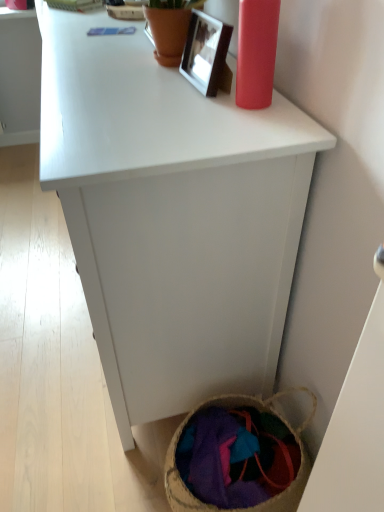
Question: Considering the relative sizes of metallic silver picture frame at upper center and textured woven basket at lower right in the image provided, is metallic silver picture frame at upper center smaller than textured woven basket at lower right?

Choices:
 (A) no
 (B) yes

Answer: (B)

Question: From the image's perspective, is metallic silver picture frame at upper center located beneath textured woven basket at lower right?

Choices:
 (A) yes
 (B) no

Answer: (B)

Question: Can you confirm if metallic silver picture frame at upper center is thinner than textured woven basket at lower right?

Choices:
 (A) no
 (B) yes

Answer: (B)

Question: Does metallic silver picture frame at upper center have a lesser height compared to textured woven basket at lower right?

Choices:
 (A) no
 (B) yes

Answer: (A)

Question: Is metallic silver picture frame at upper center looking in the opposite direction of textured woven basket at lower right?

Choices:
 (A) yes
 (B) no

Answer: (B)

Question: From a real-world perspective, does metallic silver picture frame at upper center sit lower than textured woven basket at lower right?

Choices:
 (A) no
 (B) yes

Answer: (A)

Question: Is the surface of white matte cabinet at center in direct contact with metallic silver picture frame at upper center?

Choices:
 (A) yes
 (B) no

Answer: (B)

Question: Is metallic silver picture frame at upper center a part of white matte cabinet at center?

Choices:
 (A) no
 (B) yes

Answer: (A)

Question: Can you confirm if white matte cabinet at center is shorter than metallic silver picture frame at upper center?

Choices:
 (A) yes
 (B) no

Answer: (B)

Question: Is white matte cabinet at center positioned with its back to metallic silver picture frame at upper center?

Choices:
 (A) no
 (B) yes

Answer: (A)

Question: Is white matte cabinet at center positioned before metallic silver picture frame at upper center?

Choices:
 (A) yes
 (B) no

Answer: (A)

Question: From a real-world perspective, is white matte cabinet at center below metallic silver picture frame at upper center?

Choices:
 (A) yes
 (B) no

Answer: (A)

Question: Could you tell me if white matte cabinet at center is facing textured woven basket at lower right?

Choices:
 (A) no
 (B) yes

Answer: (A)